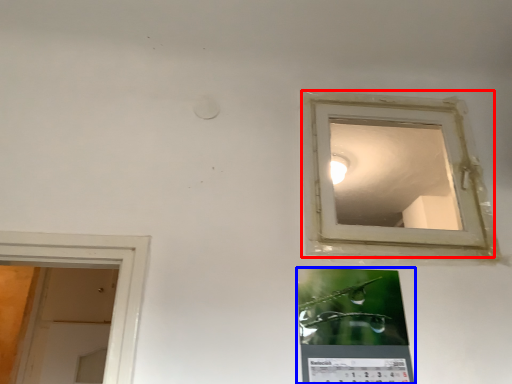
Question: Which point is closer to the camera, window (highlighted by a red box) or bulletin board (highlighted by a blue box)?

Choices:
 (A) window
 (B) bulletin board

Answer: (B)